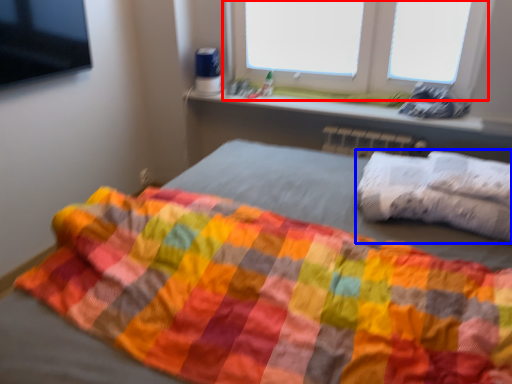
Question: Among these objects, which one is farthest to the camera, window (highlighted by a red box) or throw pillow (highlighted by a blue box)?

Choices:
 (A) window
 (B) throw pillow

Answer: (A)